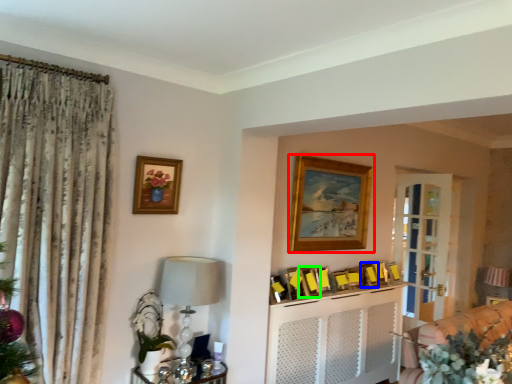
Question: Which is nearer to the picture frame (highlighted by a red box)? picture frame (highlighted by a blue box) or picture frame (highlighted by a green box).

Choices:
 (A) picture frame
 (B) picture frame

Answer: (B)